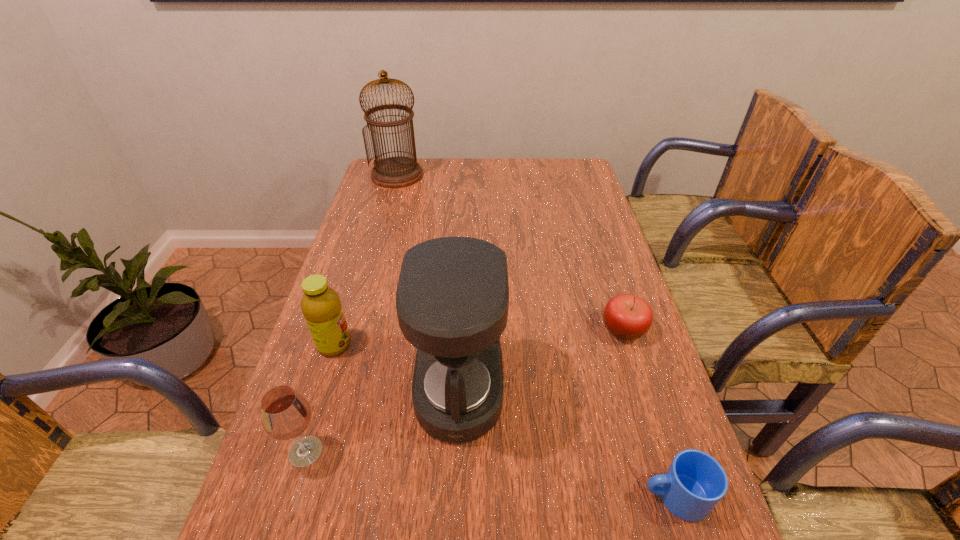
The height and width of the screenshot is (540, 960). I want to click on free space that satisfies the following two spatial constraints: 1. on the front label of the wineglass; 2. on the right side of the fruit juice, so click(301, 451).

At what (x,y) coordinates should I click in order to perform the action: click on vacant space that satisfies the following two spatial constraints: 1. on the back side of the wineglass; 2. on the left side of the apple. Please return your answer as a coordinate pair (x, y). Looking at the image, I should click on click(x=343, y=330).

You are a GUI agent. You are given a task and a screenshot of the screen. Output one action in this format:
    pyautogui.click(x=<x>, y=<y>)
    Task: Click on the vacant space that satisfies the following two spatial constraints: 1. on the front label of the fruit juice; 2. on the right side of the wineglass
    Image resolution: width=960 pixels, height=540 pixels.
    Given the screenshot: What is the action you would take?
    pyautogui.click(x=301, y=451)